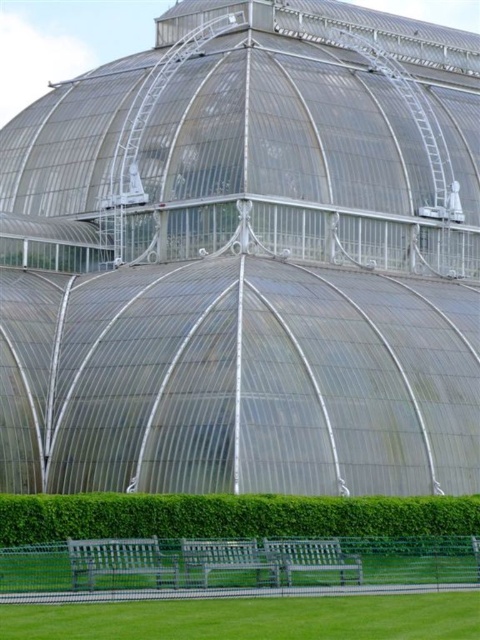
You are a visitor standing in front of the greenhouse and want to sit down. You see the green leafy hedge at lower center and the green wooden bench at lower center. Which object is on the right side of the bench?

The green leafy hedge at lower center is positioned on the right side of the green wooden bench at lower center.

You are planning to place a new flower pot between the green wooden bench at lower center and the wooden park bench at lower center. Which bench should the flower pot be closer to if you want it to be placed on the narrower side of the two benches?

The green wooden bench at lower center is thinner than the wooden park bench at lower center, so the flower pot should be placed closer to the green wooden bench at lower center to be on the narrower side.

You are a visitor standing in front of the greenhouse and want to sit down. There is a green leafy hedge at lower center and a green wooden bench at lower center. Which object is taller and can you sit on it?

The green leafy hedge at lower center is taller than the green wooden bench at lower center. However, you cannot sit on the hedge because it is a plant and the bench is designed for sitting.